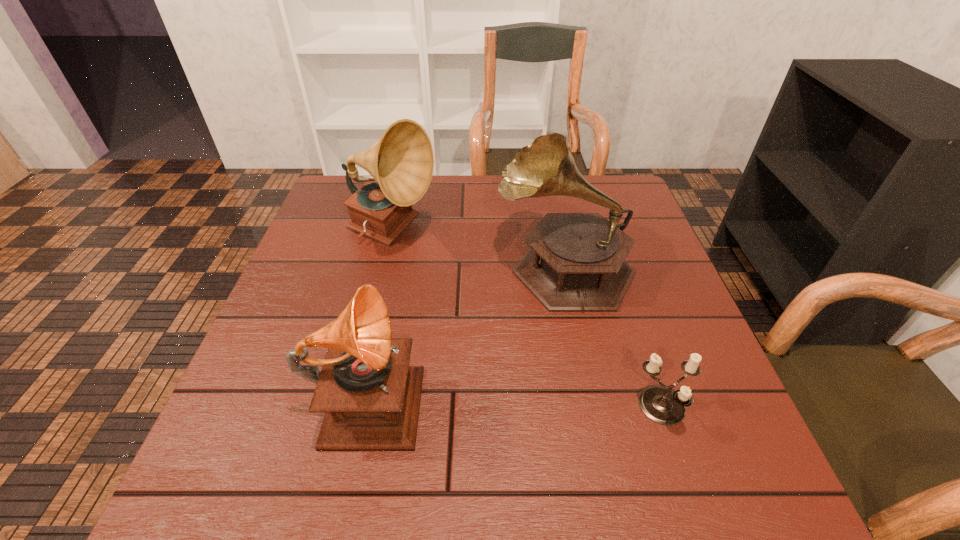
Select which object appears as the second closest to the candle holder. Please provide its 2D coordinates. Your answer should be formatted as a tuple, i.e. [(x, y)], where the tuple contains the x and y coordinates of a point satisfying the conditions above.

[(371, 397)]

Locate an element on the screen. The image size is (960, 540). object that stands as the second closest to the nearest phonograph record is located at coordinates point(401,162).

Select which phonograph record appears as the closest to the nearest phonograph record. Please provide its 2D coordinates. Your answer should be formatted as a tuple, i.e. [(x, y)], where the tuple contains the x and y coordinates of a point satisfying the conditions above.

[(576, 261)]

Identify which phonograph record is the second nearest to the shortest object. Please provide its 2D coordinates. Your answer should be formatted as a tuple, i.e. [(x, y)], where the tuple contains the x and y coordinates of a point satisfying the conditions above.

[(371, 397)]

I want to click on vacant point that satisfies the following two spatial constraints: 1. on the horn direction of the shortest object; 2. on the right side of the rightmost phonograph record, so [x=594, y=408].

The image size is (960, 540). In order to click on free location that satisfies the following two spatial constraints: 1. on the horn direction of the rightmost phonograph record; 2. on the back side of the candle holder in this screenshot , I will do `click(594, 408)`.

The width and height of the screenshot is (960, 540). Identify the location of vacant space that satisfies the following two spatial constraints: 1. on the horn direction of the rightmost phonograph record; 2. on the left side of the shortest object. (594, 408).

At what (x,y) coordinates should I click in order to perform the action: click on free location that satisfies the following two spatial constraints: 1. on the horn of the nearest phonograph record; 2. on the right side of the candle holder. Please return your answer as a coordinate pair (x, y). The width and height of the screenshot is (960, 540). Looking at the image, I should click on (365, 408).